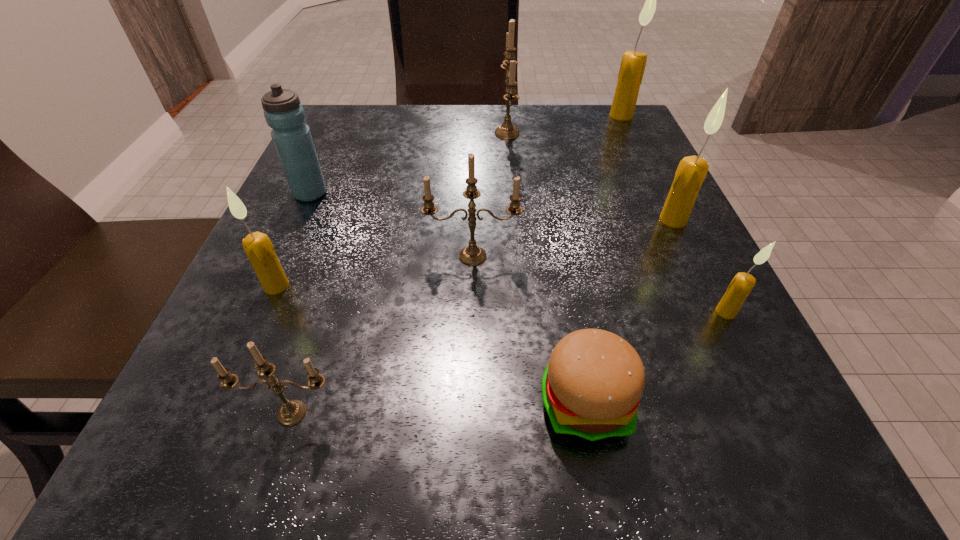
Find the location of a particular element. free spot located 0.200m on the back of the second smallest cream candle is located at coordinates (315, 198).

Image resolution: width=960 pixels, height=540 pixels. Identify the location of free space located 0.100m on the front of the fifth nearest object. (471, 317).

Locate an element on the screen. This screenshot has width=960, height=540. vacant space located 0.260m on the left of the second nearest candle is located at coordinates (529, 312).

Identify the location of vacant region located 0.200m on the right of the leftmost metallic candle. The width and height of the screenshot is (960, 540). (514, 413).

Locate an element on the screen. This screenshot has height=540, width=960. free space located 0.060m on the right of the hamburger is located at coordinates (681, 403).

This screenshot has width=960, height=540. What are the coordinates of `candle at the near edge` in the screenshot? It's located at (292, 412).

Identify the location of hamburger at the near edge. This screenshot has width=960, height=540. (592, 386).

What are the coordinates of `water bottle that is at the left edge` in the screenshot? It's located at (283, 112).

Where is `object present at the near left corner`? The width and height of the screenshot is (960, 540). object present at the near left corner is located at coordinates (292, 412).

Where is `object positioned at the far right corner`? The width and height of the screenshot is (960, 540). object positioned at the far right corner is located at coordinates (633, 63).